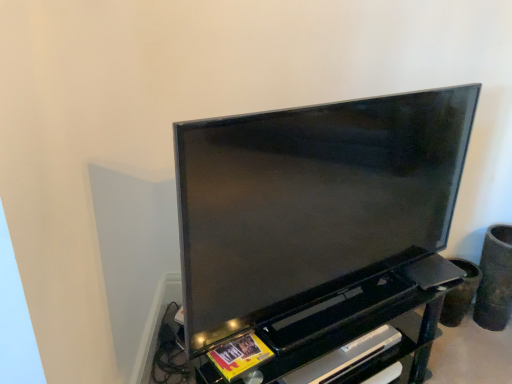
Question: From a real-world perspective, does matte black tv at center stand above black glossy entertainment center at center?

Choices:
 (A) yes
 (B) no

Answer: (A)

Question: From the image's perspective, is matte black tv at center located above black glossy entertainment center at center?

Choices:
 (A) no
 (B) yes

Answer: (B)

Question: Can black glossy entertainment center at center be found inside matte black tv at center?

Choices:
 (A) yes
 (B) no

Answer: (B)

Question: Are matte black tv at center and black glossy entertainment center at center beside each other?

Choices:
 (A) yes
 (B) no

Answer: (B)

Question: Considering the relative sizes of matte black tv at center and black glossy entertainment center at center in the image provided, is matte black tv at center bigger than black glossy entertainment center at center?

Choices:
 (A) no
 (B) yes

Answer: (A)

Question: Does matte black tv at center have a lesser width compared to black glossy entertainment center at center?

Choices:
 (A) yes
 (B) no

Answer: (A)

Question: From the image's perspective, is black glossy entertainment center at center over matte black tv at center?

Choices:
 (A) yes
 (B) no

Answer: (B)

Question: From a real-world perspective, is black glossy entertainment center at center positioned under matte black tv at center based on gravity?

Choices:
 (A) yes
 (B) no

Answer: (A)

Question: From the image's perspective, is black glossy entertainment center at center located beneath matte black tv at center?

Choices:
 (A) no
 (B) yes

Answer: (B)

Question: Does black glossy entertainment center at center have a larger size compared to matte black tv at center?

Choices:
 (A) no
 (B) yes

Answer: (B)

Question: Is matte black tv at center a part of black glossy entertainment center at center?

Choices:
 (A) no
 (B) yes

Answer: (A)

Question: Can you confirm if black glossy entertainment center at center is smaller than matte black tv at center?

Choices:
 (A) no
 (B) yes

Answer: (A)

Question: Is the surface of matte black tv at center in direct contact with black plastic shelf at lower center?

Choices:
 (A) yes
 (B) no

Answer: (B)